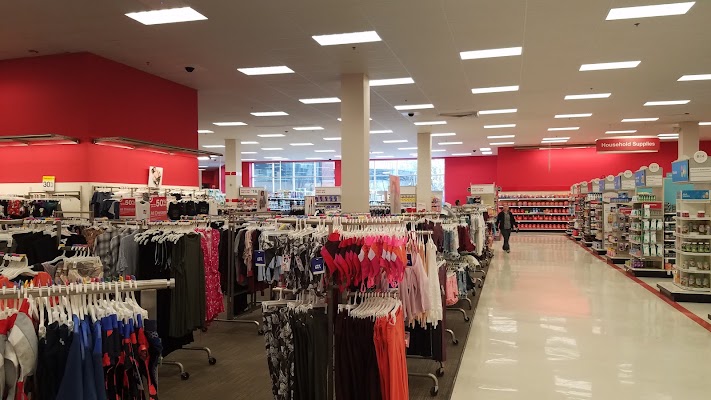
The height and width of the screenshot is (400, 711). In order to click on windows in this screenshot , I will do `click(407, 163)`, `click(321, 169)`, `click(284, 172)`.